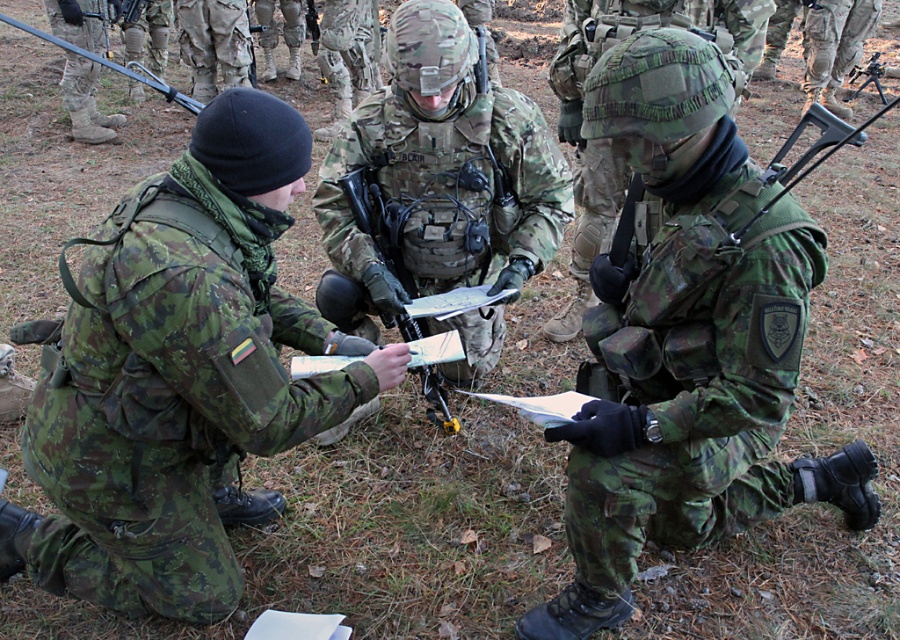
Where is `camouflage uniform at left`? camouflage uniform at left is located at coordinates (178, 376).

Does camouflage uniform at left come in front of camouflage fabric rifle at center?

Yes.

Which is in front, point (50, 557) or point (403, 285)?

Point (50, 557) is more forward.

Identify the location of camouflage uniform at left. The image size is (900, 640). (178, 376).

Based on the photo, which is below, camouflage uniform at left or camouflage fabric helmet at center?

camouflage uniform at left

Does camouflage uniform at left come behind camouflage fabric helmet at center?

No, camouflage uniform at left is in front of camouflage fabric helmet at center.

Is point (146, 605) positioned in front of point (676, 19)?

Yes, point (146, 605) is closer to viewer.

Image resolution: width=900 pixels, height=640 pixels. Find the location of `camouflage uniform at left`. camouflage uniform at left is located at coordinates (178, 376).

Which is more to the left, camouflage fabric uniform at center or camouflage fabric helmet at center?

Positioned to the left is camouflage fabric uniform at center.

Is the position of camouflage fabric uniform at center more distant than that of camouflage fabric helmet at center?

No, camouflage fabric uniform at center is in front of camouflage fabric helmet at center.

Which is in front, point (610, 609) or point (579, 120)?

Point (610, 609) is in front.

The height and width of the screenshot is (640, 900). I want to click on camouflage fabric uniform at center, so click(x=686, y=337).